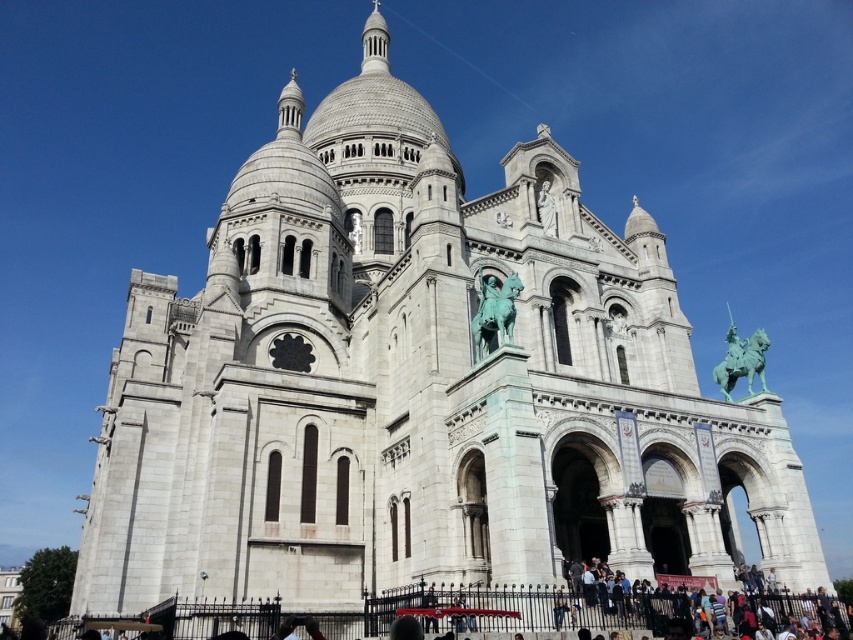
You are standing in front of the Basilica of the Sacred Heart of Paris and notice the green patina horseman at upper right. Can you determine its exact position on the image using coordinates?

The green patina horseman at upper right is located at point coordinates of 0.562 on the x axis and 0.870 on the y axis.

You are standing at the entrance of the Basilica of the Sacred Heart of Paris and want to locate the white stone statue at upper center. According to the image, where exactly is this statue positioned in relation to the entrance?

The white stone statue at upper center is positioned at coordinates point (x=546, y=209) relative to the entrance.